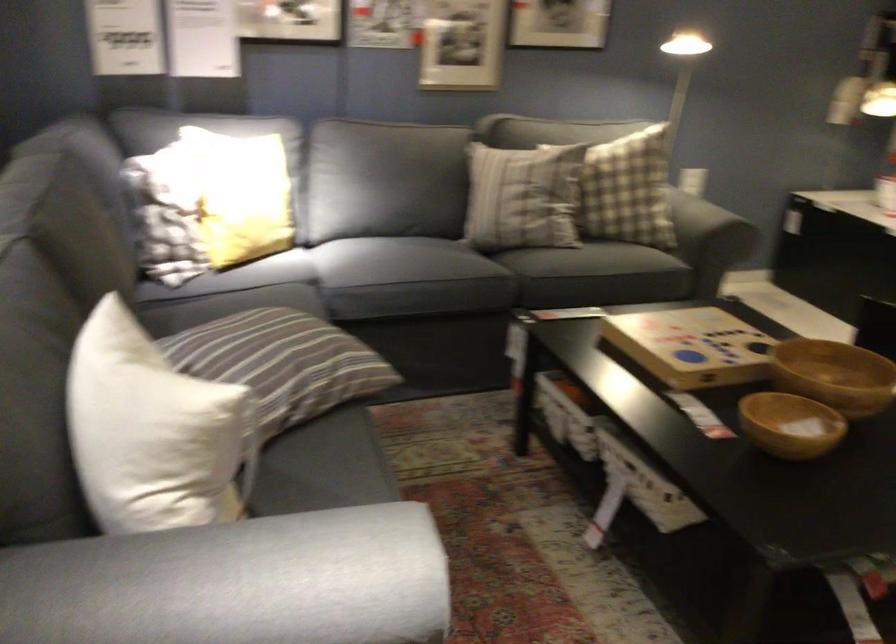
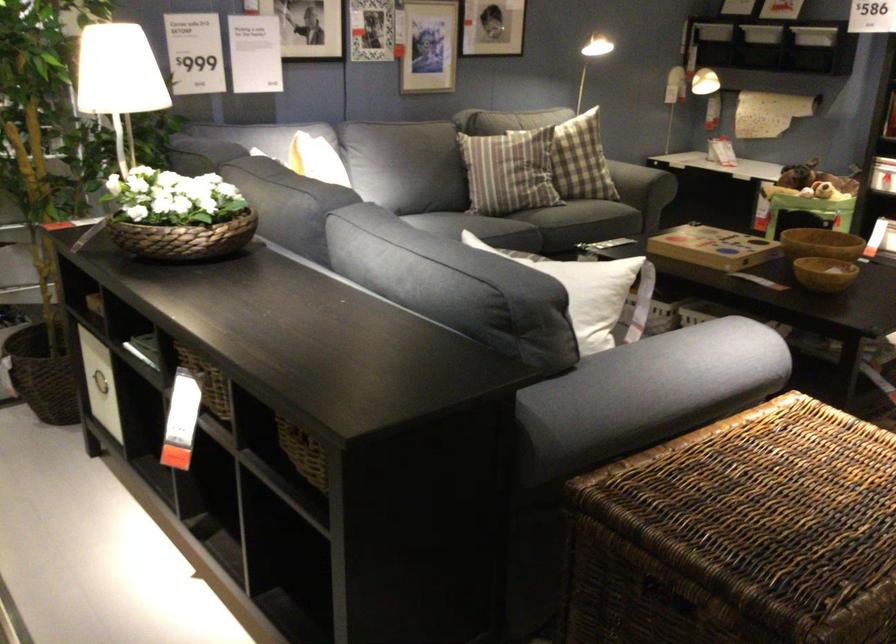
Where in the second image is the point corresponding to point (485, 185) from the first image?

(507, 172)